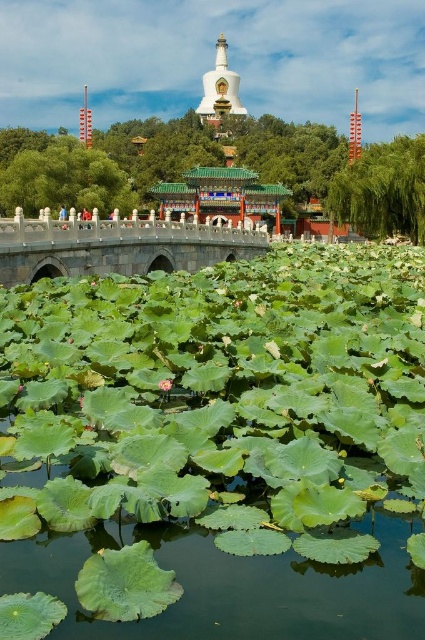
Question: Can you confirm if green leafy water at center is bigger than stone bridge at center?

Choices:
 (A) no
 (B) yes

Answer: (A)

Question: Is green leafy water at center wider than stone bridge at center?

Choices:
 (A) yes
 (B) no

Answer: (B)

Question: Is green leafy water at center below stone bridge at center?

Choices:
 (A) yes
 (B) no

Answer: (A)

Question: Which point appears closest to the camera in this image?

Choices:
 (A) (127, 232)
 (B) (170, 605)

Answer: (B)

Question: Which object appears farthest from the camera in this image?

Choices:
 (A) stone bridge at center
 (B) green leafy water at center

Answer: (A)